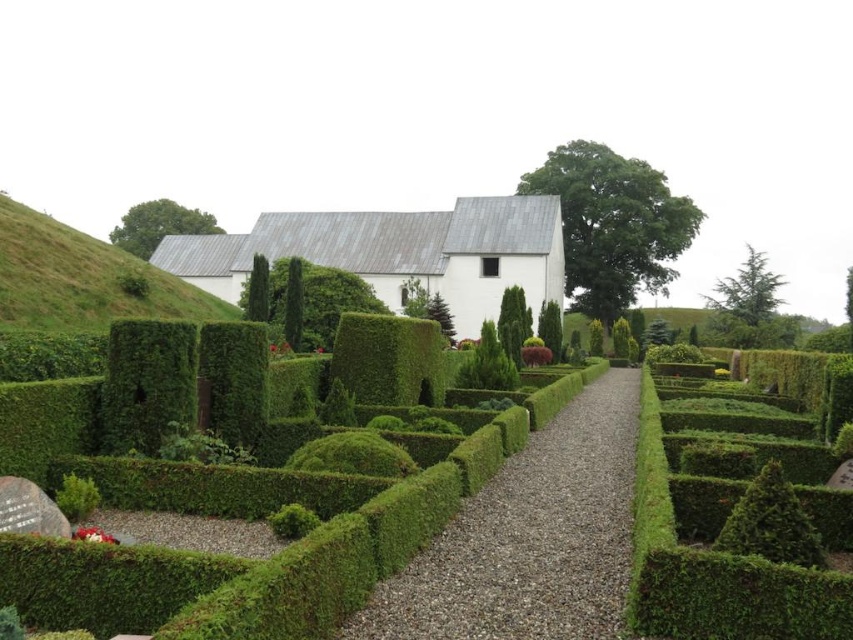
Is gravel path at center further to camera compared to green leafy bush at lower right?

No, it is not.

Find the location of a particular element. gravel path at center is located at coordinates (531, 538).

This screenshot has height=640, width=853. Identify the location of gravel path at center. [x=531, y=538].

Which is behind, point (175, 280) or point (793, 547)?

Point (175, 280)

Is point (70, 291) less distant than point (741, 554)?

That is False.

The width and height of the screenshot is (853, 640). I want to click on green grassy hillside at upper left, so click(x=82, y=280).

Who is higher up, green leafy bush at upper center or green leafy bush at center?

green leafy bush at upper center

Is green leafy bush at upper center to the left of green leafy bush at center from the viewer's perspective?

Incorrect, green leafy bush at upper center is not on the left side of green leafy bush at center.

Between point (579, 275) and point (326, 289), which one is positioned behind?

The point (579, 275) is behind.

Locate an element on the screen. Image resolution: width=853 pixels, height=640 pixels. green leafy bush at upper center is located at coordinates (612, 225).